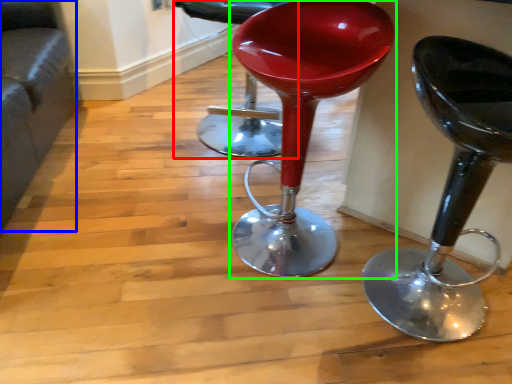
Question: Based on their relative distances, which object is nearer to chair (highlighted by a red box)? Choose from couch (highlighted by a blue box) and stool (highlighted by a green box).

Choices:
 (A) couch
 (B) stool

Answer: (B)